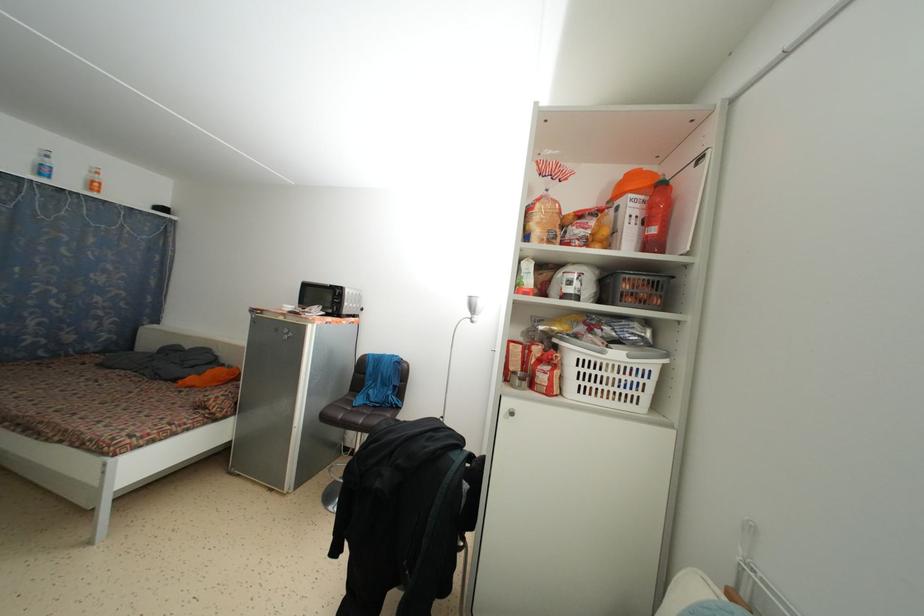
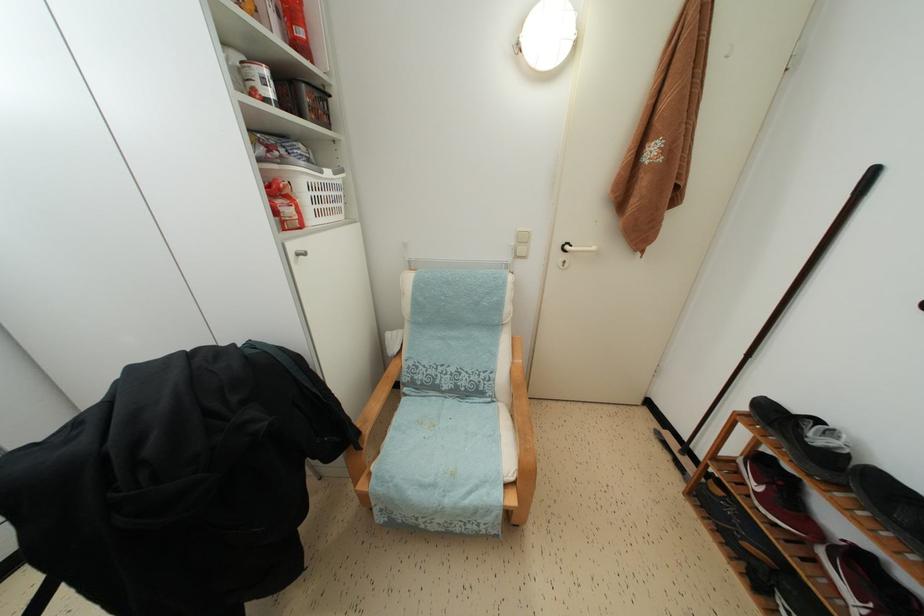
Find the pixel in the second image that matches [658,236] in the first image.

(305, 38)